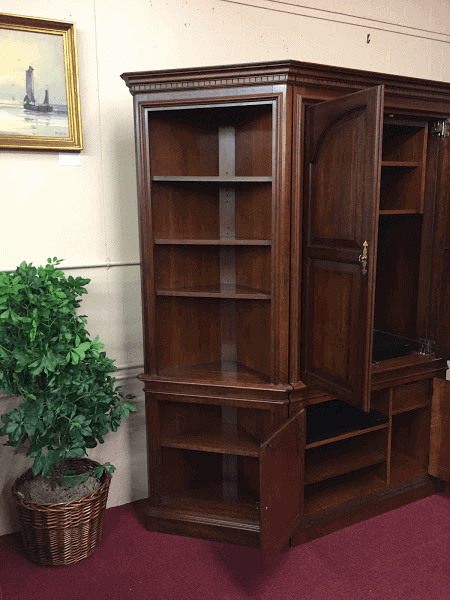
This screenshot has width=450, height=600. Identify the location of plant. (55, 466).